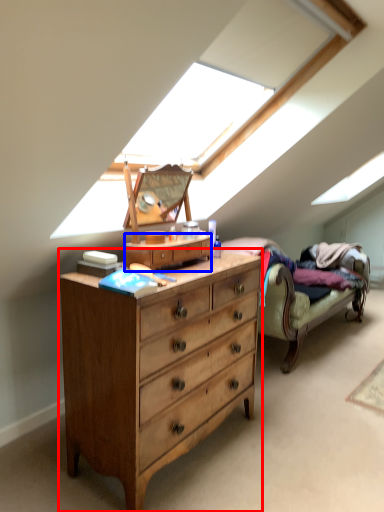
Question: Among these objects, which one is nearest to the camera, chest of drawers (highlighted by a red box) or file cabinet (highlighted by a blue box)?

Choices:
 (A) chest of drawers
 (B) file cabinet

Answer: (A)